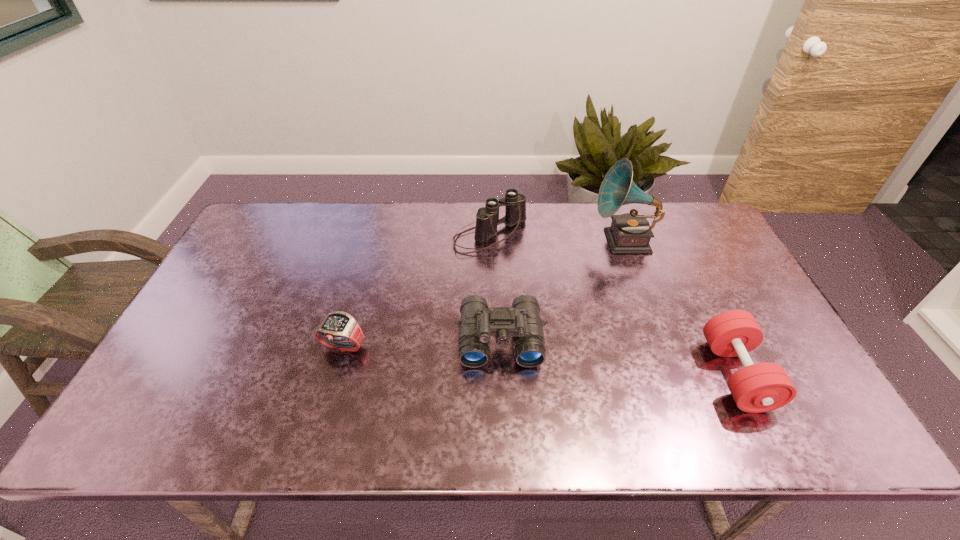
Identify the location of blank space located 0.170m through the lenses of the nearer binoculars. This screenshot has width=960, height=540. (504, 434).

Where is `vacant area located 0.310m on the left of the dumbbell`? The height and width of the screenshot is (540, 960). vacant area located 0.310m on the left of the dumbbell is located at coordinates (585, 374).

This screenshot has width=960, height=540. I want to click on free space located 0.350m on the right of the shortest object, so click(x=502, y=347).

Image resolution: width=960 pixels, height=540 pixels. Find the location of `phonograph_record that is at the far edge`. phonograph_record that is at the far edge is located at coordinates (629, 233).

Identify the location of binoculars that is at the far edge. The height and width of the screenshot is (540, 960). (487, 218).

This screenshot has width=960, height=540. I want to click on object positioned at the near edge, so click(x=762, y=387).

Identify the location of object at the right edge. The height and width of the screenshot is (540, 960). (762, 387).

This screenshot has height=540, width=960. Find the location of `object that is positioned at the near right corner`. object that is positioned at the near right corner is located at coordinates (762, 387).

At what (x,y) coordinates should I click in order to perform the action: click on free spot at the far edge of the desktop. Please return your answer as a coordinate pair (x, y). The image size is (960, 540). Looking at the image, I should click on pyautogui.click(x=590, y=214).

The height and width of the screenshot is (540, 960). I want to click on free space at the near edge of the desktop, so click(618, 417).